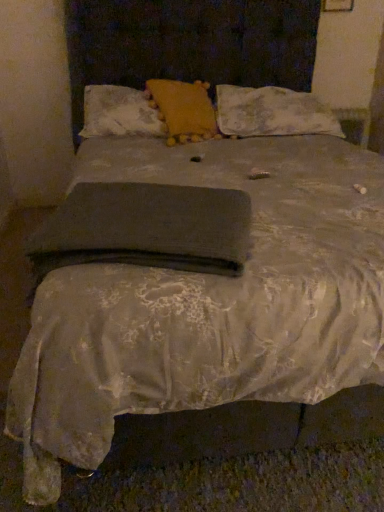
Question: Is floral lace pillow at upper right, the 1th pillow when ordered from right to left, taller or shorter than yellow fabric pillow at center, which ranks as the 2th pillow in right-to-left order?

Choices:
 (A) short
 (B) tall

Answer: (A)

Question: In the image, is floral lace pillow at upper right, which appears as the 3th pillow when viewed from the left, positioned in front of or behind yellow fabric pillow at center, which ranks as the 2th pillow in right-to-left order?

Choices:
 (A) behind
 (B) front

Answer: (A)

Question: Estimate the real-world distances between objects in this image. Which object is farther from the matte yellow pillow at upper center, which is counted as the 1th pillow, starting from the left?

Choices:
 (A) floral lace pillow at upper right, the 1th pillow when ordered from right to left
 (B) dark gray fabric at center
 (C) yellow fabric pillow at center, which ranks as the 2th pillow in right-to-left order

Answer: (B)

Question: Which object is the closest to the matte yellow pillow at upper center, which is counted as the 1th pillow, starting from the left?

Choices:
 (A) floral lace pillow at upper right, the 1th pillow when ordered from right to left
 (B) dark gray fabric at center
 (C) yellow fabric pillow at center, which ranks as the 2th pillow in right-to-left order

Answer: (C)